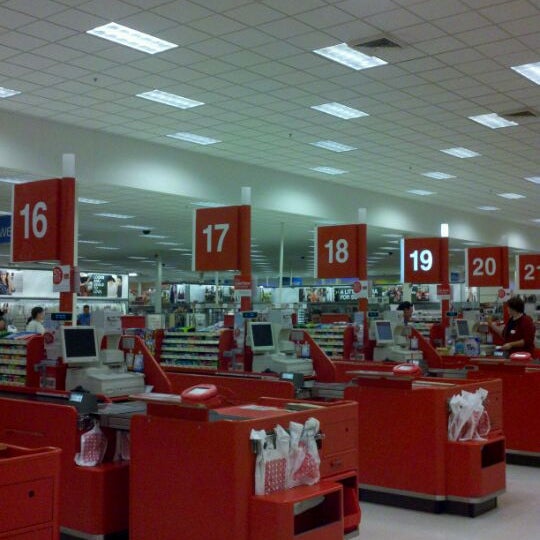
You are a GUI agent. You are given a task and a screenshot of the screen. Output one action in this format:
    pyautogui.click(x=<x>, y=<y>)
    Task: Click on the computer screen
    
    Given the screenshot: What is the action you would take?
    pyautogui.click(x=76, y=336)